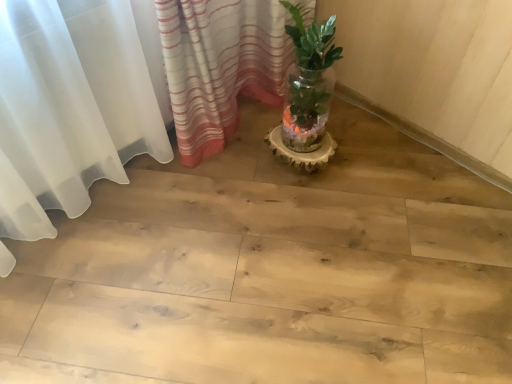
In order to face green matte plant at center, should I rotate leftwards or rightwards?

A 7.260 degree turn to the right will do.

I want to click on green matte plant at center, so click(308, 80).

What do you see at coordinates (308, 80) in the screenshot? I see `green matte plant at center` at bounding box center [308, 80].

The image size is (512, 384). What are the coordinates of `green matte plant at center` in the screenshot? It's located at (308, 80).